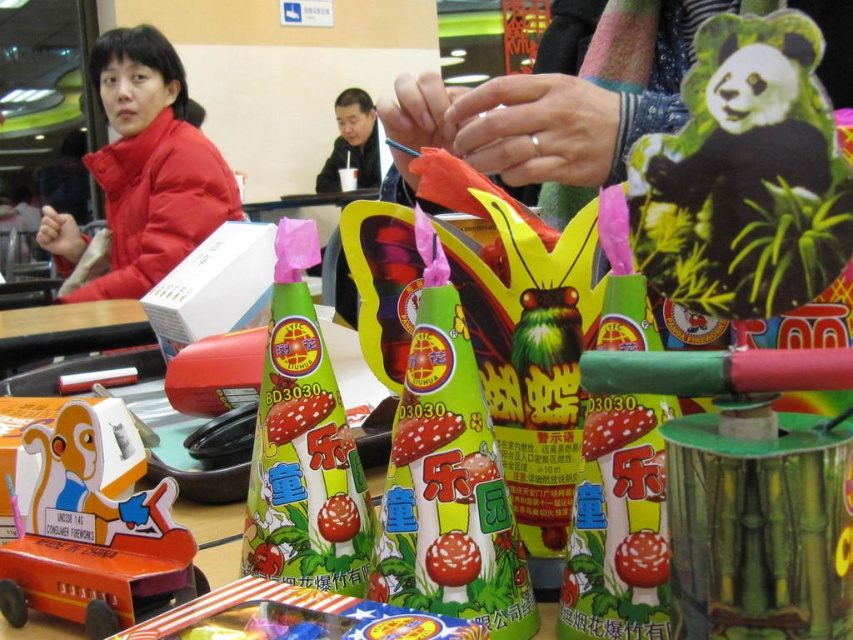
Is point (799, 19) farther from viewer compared to point (184, 90)?

No, (799, 19) is closer to viewer.

Which is behind, point (787, 266) or point (142, 212)?

The point (142, 212) is more distant.

Between point (663, 196) and point (225, 176), which one is positioned behind?

The point (225, 176) is behind.

Identify the location of black plush panda at upper right. (746, 160).

Is black plush panda at upper right closer to the viewer compared to wooden toy car at center?

Yes, black plush panda at upper right is closer to the viewer.

Find the location of a particular element. The width and height of the screenshot is (853, 640). black plush panda at upper right is located at coordinates (746, 160).

Locate an element on the screen. black plush panda at upper right is located at coordinates (746, 160).

From the picture: Does green matte toy at center have a greater width compared to matte red jacket at upper left?

No.

You are a GUI agent. You are given a task and a screenshot of the screen. Output one action in this format:
    pyautogui.click(x=<x>, y=<y>)
    Task: Click on the green matte toy at center
    This screenshot has width=853, height=640.
    Given the screenshot: What is the action you would take?
    303,445